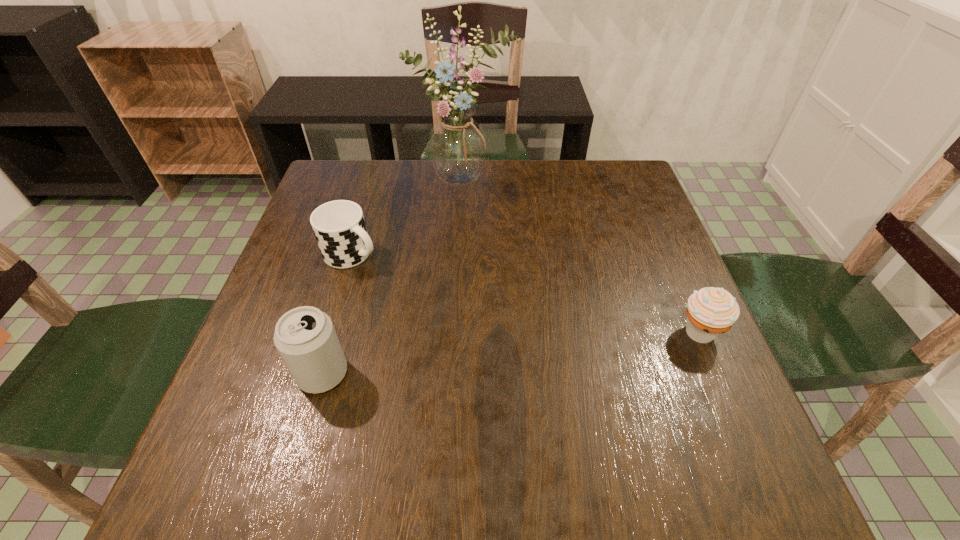
Where is `free spot that satisfies the following two spatial constraints: 1. on the back side of the third shortest object; 2. on the right side of the third farthest object`? The image size is (960, 540). free spot that satisfies the following two spatial constraints: 1. on the back side of the third shortest object; 2. on the right side of the third farthest object is located at coordinates (334, 332).

Identify the location of free space that satisfies the following two spatial constraints: 1. on the back side of the second tallest object; 2. on the right side of the muffin. (334, 332).

This screenshot has height=540, width=960. What are the coordinates of `vacant region that satisfies the following two spatial constraints: 1. on the back side of the third nearest object; 2. on the left side of the tallest object` in the screenshot? It's located at pos(373,180).

The height and width of the screenshot is (540, 960). I want to click on vacant region that satisfies the following two spatial constraints: 1. on the front side of the tallest object; 2. on the left side of the rightmost object, so click(456, 332).

Find the location of a particular element. This screenshot has width=960, height=540. free region that satisfies the following two spatial constraints: 1. on the back side of the second nearest object; 2. on the right side of the nearest object is located at coordinates (334, 332).